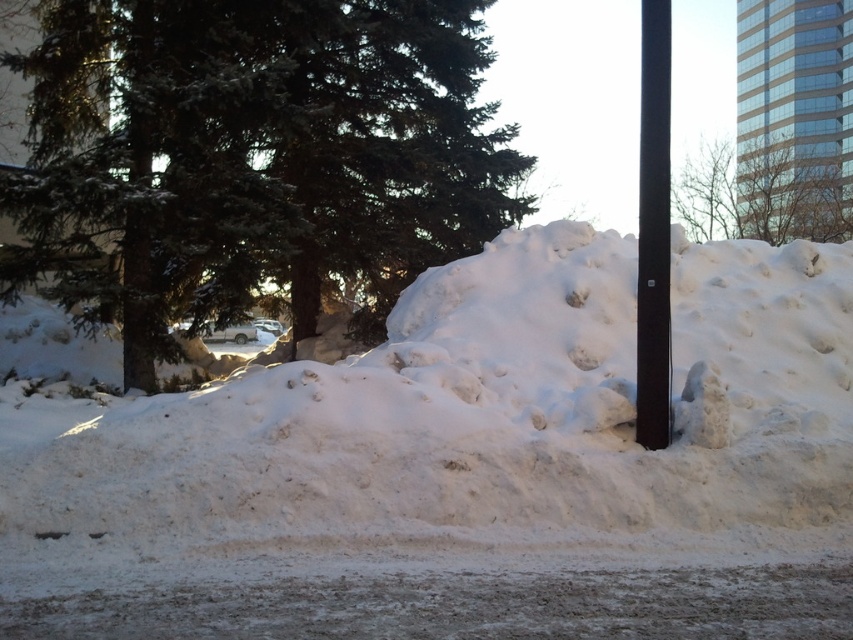
Question: Can you confirm if green textured pine at upper left is thinner than black smooth pole at right?

Choices:
 (A) no
 (B) yes

Answer: (A)

Question: Observing the image, what is the correct spatial positioning of white fluffy snow at center in reference to green textured pine at upper left?

Choices:
 (A) right
 (B) left

Answer: (A)

Question: Is white fluffy snow at center below green textured pine at upper left?

Choices:
 (A) yes
 (B) no

Answer: (A)

Question: Considering the real-world distances, which object is closest to the black smooth pole at right?

Choices:
 (A) green textured pine at upper left
 (B) white fluffy snow at center

Answer: (B)

Question: Which of the following is the farthest from the observer?

Choices:
 (A) green textured pine at upper left
 (B) black smooth pole at right

Answer: (A)

Question: Which point is farther from the camera taking this photo?

Choices:
 (A) (640, 208)
 (B) (358, 99)
 (C) (271, 458)

Answer: (B)